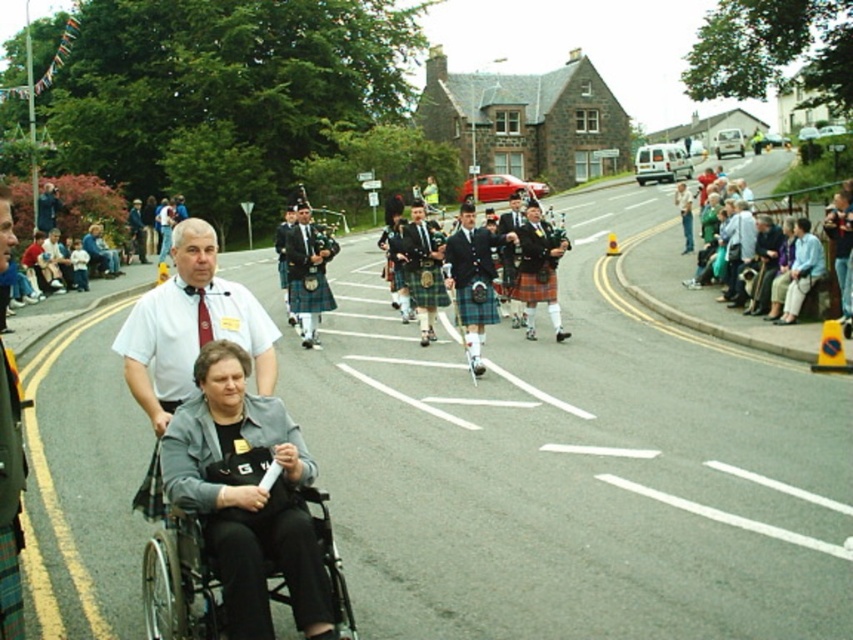
Question: Can you confirm if white shirt at center is positioned below black plastic wheelchair at lower left?

Choices:
 (A) yes
 (B) no

Answer: (B)

Question: Can you confirm if white shirt at center is smaller than green plaid kilt at center?

Choices:
 (A) no
 (B) yes

Answer: (B)

Question: Which object is the closest to the white shirt at center?

Choices:
 (A) green plaid kilt at center
 (B) black plastic wheelchair at lower left

Answer: (B)

Question: Which object appears farthest from the camera in this image?

Choices:
 (A) black plastic wheelchair at lower left
 (B) white shirt at center
 (C) green plaid kilt at center

Answer: (B)

Question: Which object appears closest to the camera in this image?

Choices:
 (A) green plaid kilt at center
 (B) white shirt at center

Answer: (A)

Question: Is white shirt at center below black plastic wheelchair at lower left?

Choices:
 (A) yes
 (B) no

Answer: (B)